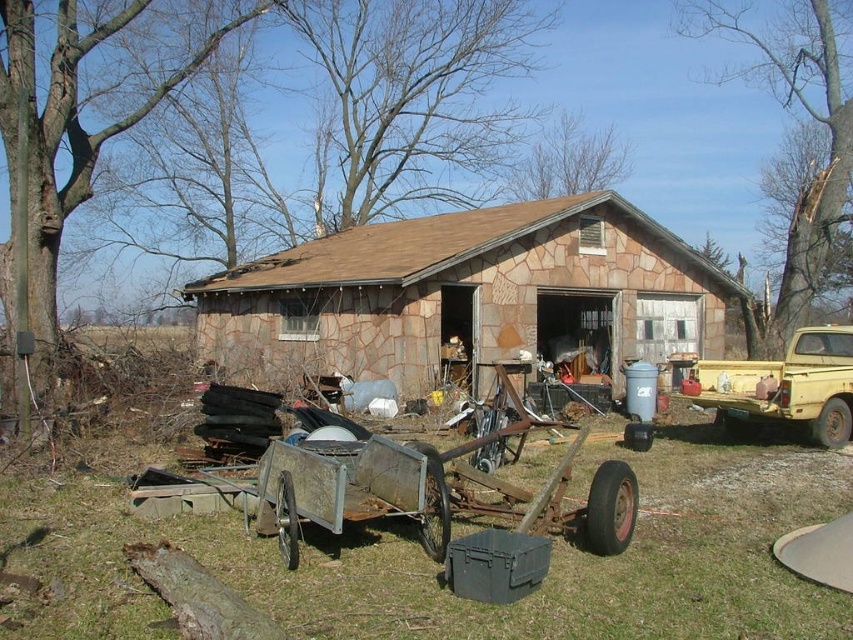
You are a delivery person trying to access the brown stone hut at center. There is a yellow matte truck at right blocking the entrance. Can you drive your delivery van through the space between the two objects?

The yellow matte truck at right is behind the brown stone hut at center, so the truck is not blocking the entrance. You can drive your delivery van to the entrance without any obstruction.

You are standing in front of the brown stone hut at center and want to move to the rusty metal cart at center. Which direction should you walk to reach it?

The rusty metal cart at center is to the right of the brown stone hut at center, so you should walk to your right to reach it.